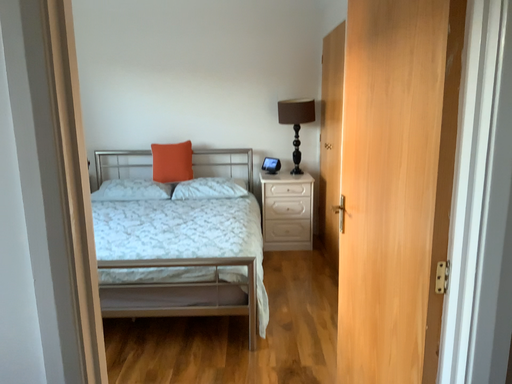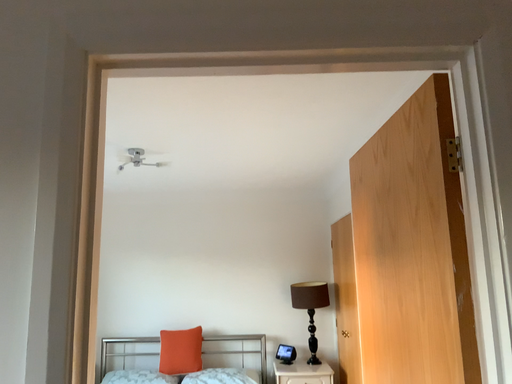
Question: How did the camera likely rotate when shooting the video?

Choices:
 (A) rotated upward
 (B) rotated downward

Answer: (A)